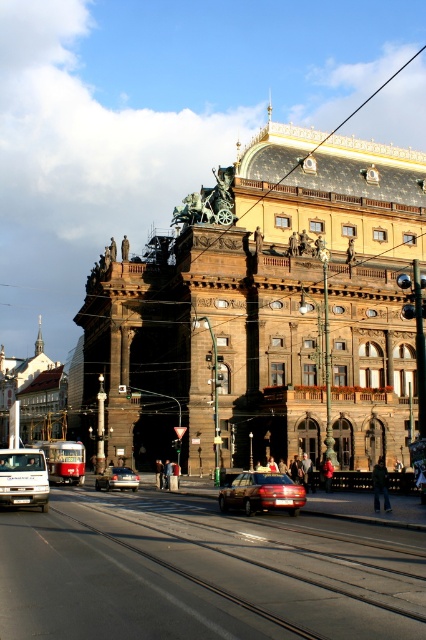
Question: Can you confirm if metal train track at lower center is bigger than white matte van at lower left?

Choices:
 (A) no
 (B) yes

Answer: (B)

Question: Which of the following is the closest to the observer?

Choices:
 (A) (36, 476)
 (B) (123, 536)
 (C) (284, 483)

Answer: (B)

Question: Based on their relative distances, which object is nearer to the shiny red sedan at center?

Choices:
 (A) silver metallic sedan at center
 (B) white matte van at lower left
 (C) metal train track at lower center

Answer: (C)

Question: Is metal train track at lower center to the right of white matte van at lower left from the viewer's perspective?

Choices:
 (A) yes
 (B) no

Answer: (A)

Question: Is white matte van at lower left positioned in front of silver metallic sedan at center?

Choices:
 (A) no
 (B) yes

Answer: (B)

Question: Which object appears closest to the camera in this image?

Choices:
 (A) white matte van at lower left
 (B) silver metallic sedan at center

Answer: (A)